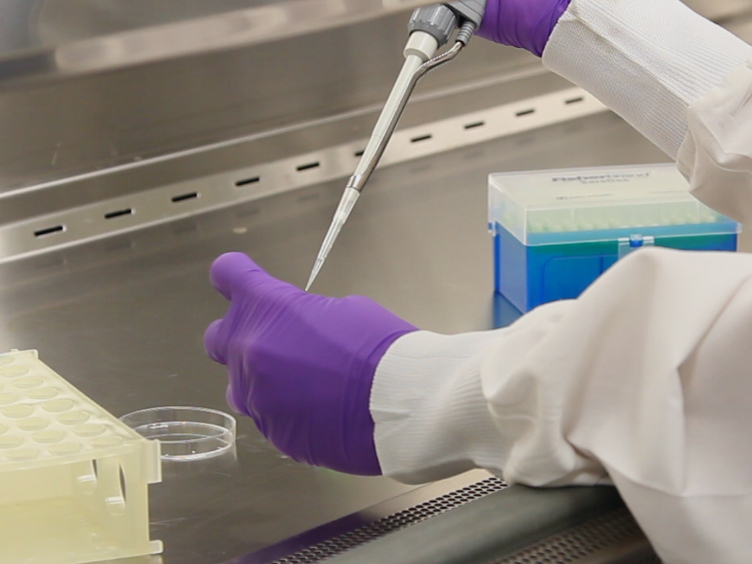
Locate an element on the screen. This screenshot has width=752, height=564. metal counter is located at coordinates (138, 290), (149, 126), (405, 213), (489, 73).